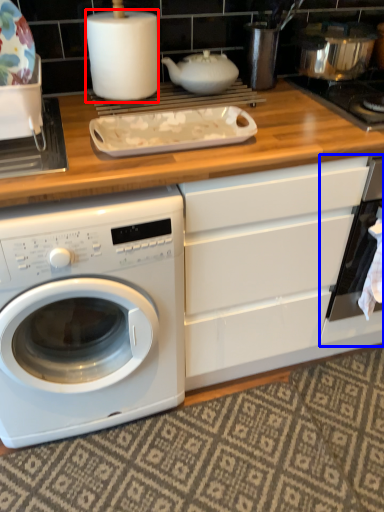
Question: Which point is further to the camera, paper towel (highlighted by a red box) or oven (highlighted by a blue box)?

Choices:
 (A) paper towel
 (B) oven

Answer: (B)